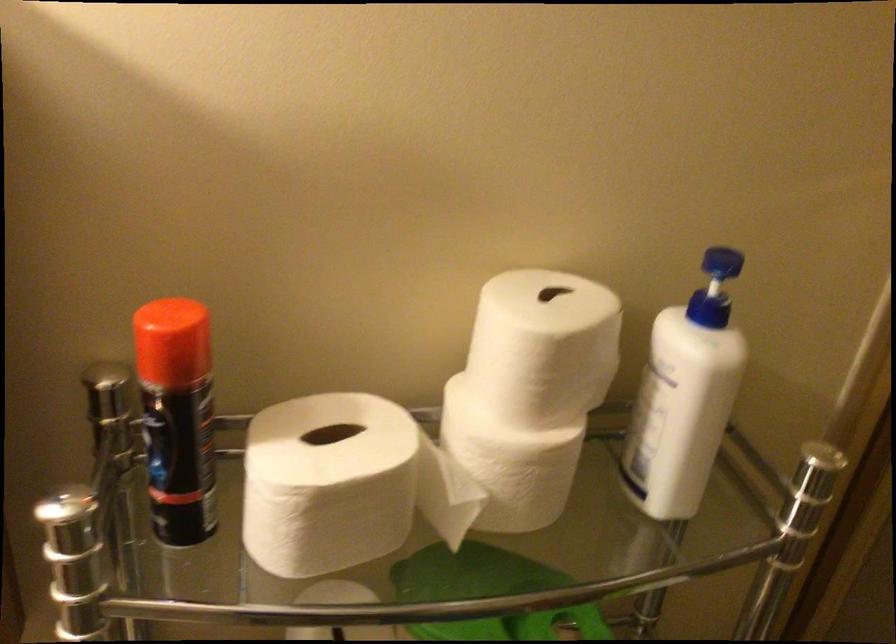
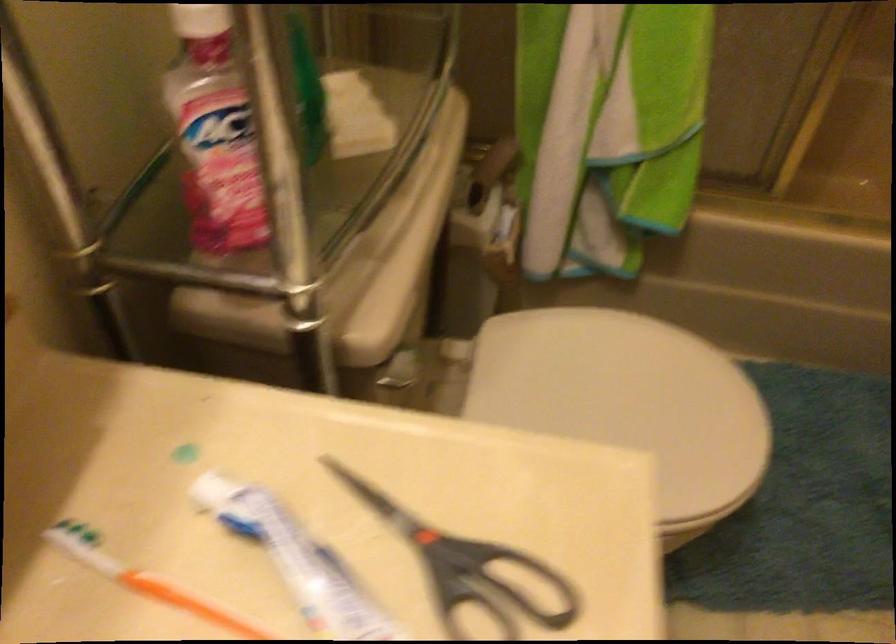
First-person continuous shooting, in which direction is the camera rotating?

The camera's rotation is toward right-down.